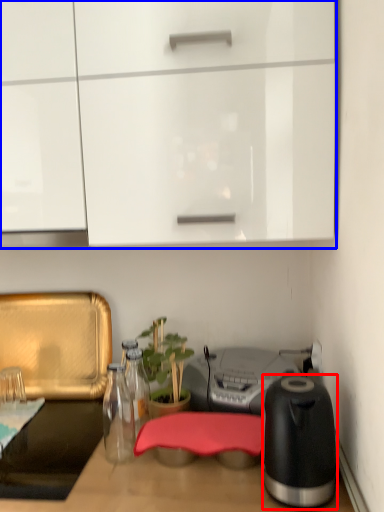
Question: Which object is further to the camera taking this photo, kitchen appliance (highlighted by a red box) or cabinetry (highlighted by a blue box)?

Choices:
 (A) kitchen appliance
 (B) cabinetry

Answer: (B)